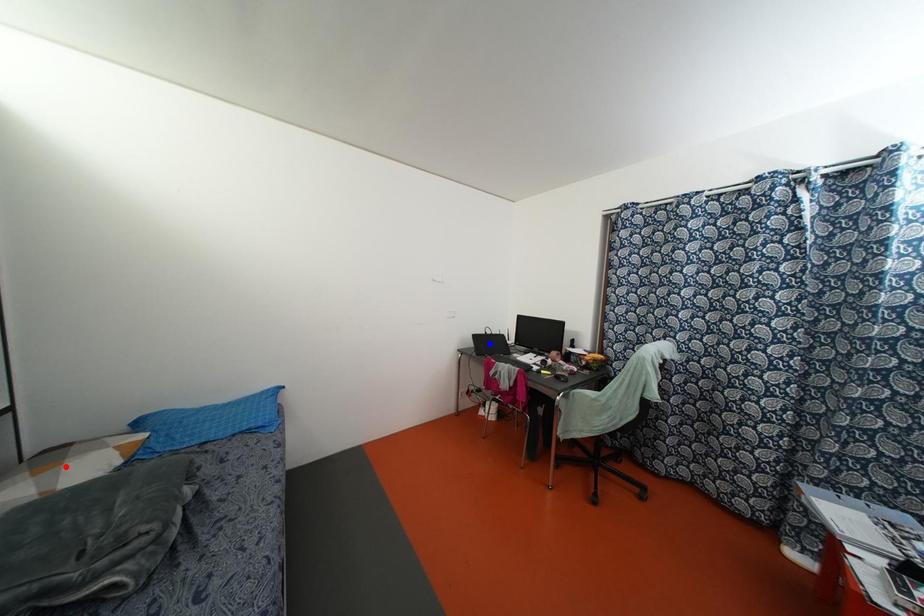
Question: Two points are marked on the image. Which point is closer to the camera?

Choices:
 (A) Blue point is closer.
 (B) Red point is closer.

Answer: (B)